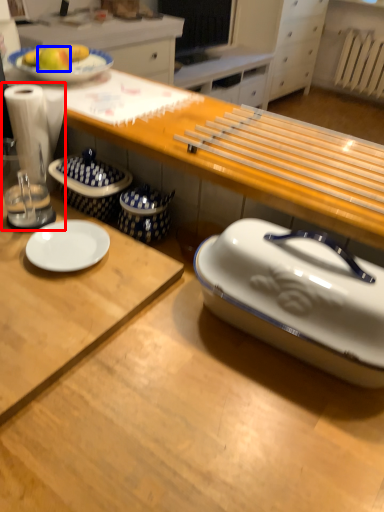
Question: Which object appears farthest to the camera in this image, blender (highlighted by a red box) or apple (highlighted by a blue box)?

Choices:
 (A) blender
 (B) apple

Answer: (B)